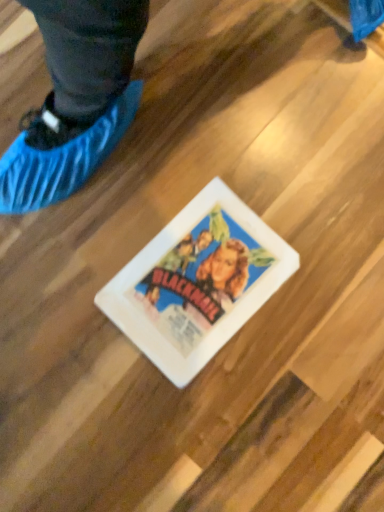
At what (x,y) coordinates should I click in order to perform the action: click on free point to the left of white glossy book cover at center. Please return your answer as a coordinate pair (x, y). This screenshot has width=384, height=512. Looking at the image, I should click on (69, 298).